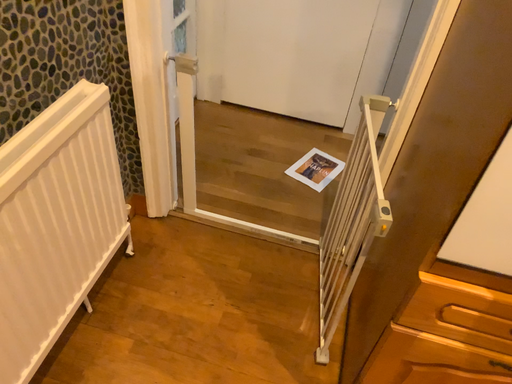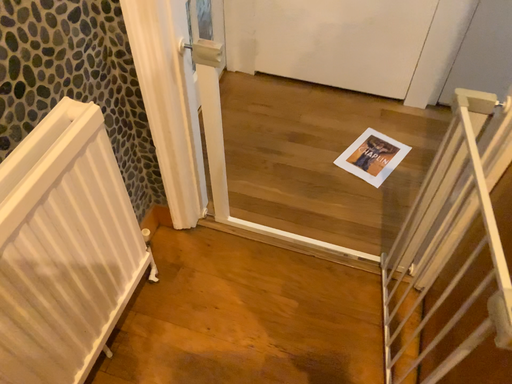
Question: Which way did the camera rotate in the video?

Choices:
 (A) rotated downward
 (B) rotated upward

Answer: (A)